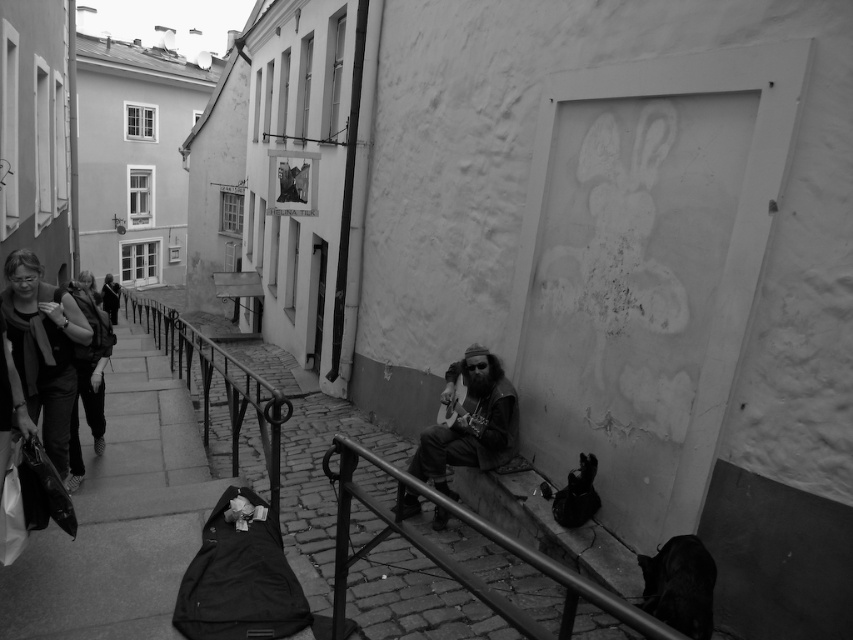
Does dark brown leather guitar at center have a larger size compared to matte black backpack at left?

No, dark brown leather guitar at center is not bigger than matte black backpack at left.

Is dark brown leather guitar at center thinner than matte black backpack at left?

Yes.

Is point (471, 429) positioned in front of point (97, 333)?

Yes, point (471, 429) is closer to viewer.

Find the location of `dark brown leather guitar at center`. dark brown leather guitar at center is located at coordinates (469, 420).

Where is `matte black jacket at left`? matte black jacket at left is located at coordinates (44, 348).

Is matte black jacket at left taller than dark brown leather guitar at center?

Yes.

Is point (33, 304) closer to viewer compared to point (474, 342)?

Yes, point (33, 304) is closer to viewer.

Identify the location of matte black jacket at left. The image size is (853, 640). (44, 348).

Can you confirm if metallic rail at lower center is smaller than matte black backpack at left?

Yes.

Locate an element on the screen. Image resolution: width=853 pixels, height=640 pixels. metallic rail at lower center is located at coordinates (456, 561).